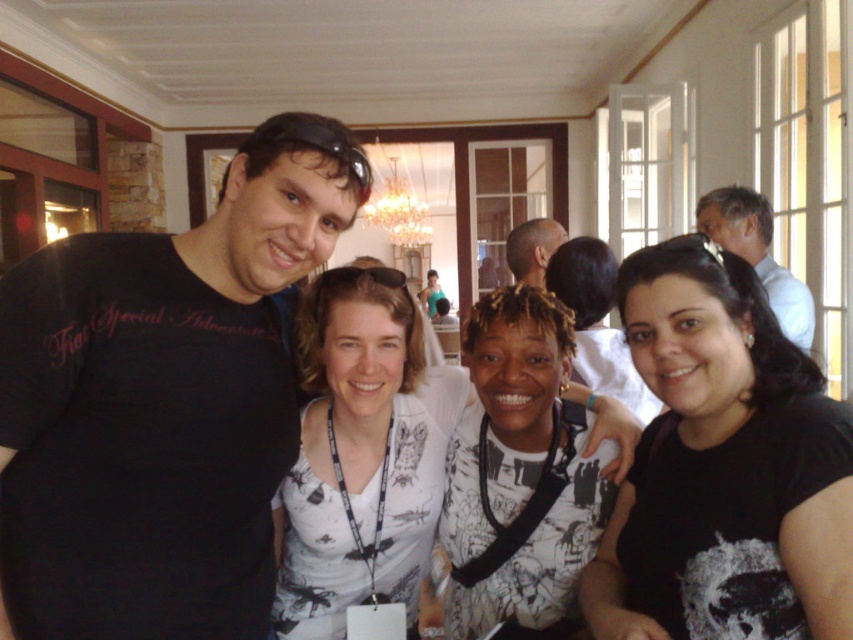
Can you confirm if black matte shirt at left is smaller than bald head at center?

No, black matte shirt at left is not smaller than bald head at center.

This screenshot has height=640, width=853. Describe the element at coordinates (161, 403) in the screenshot. I see `black matte shirt at left` at that location.

You are a GUI agent. You are given a task and a screenshot of the screen. Output one action in this format:
    pyautogui.click(x=<x>, y=<y>)
    Task: Click on the black matte shirt at left
    The image size is (853, 640).
    Given the screenshot: What is the action you would take?
    pyautogui.click(x=161, y=403)

Does black matte shirt at lower right have a smaller size compared to bald head at center?

No.

Between black matte shirt at lower right and bald head at center, which one is positioned lower?

Positioned lower is black matte shirt at lower right.

Is point (647, 616) positioned before point (515, 264)?

Yes, it is in front of point (515, 264).

I want to click on black matte shirt at lower right, so click(x=724, y=467).

Can you confirm if white shirt at upper right is positioned below bald head at center?

Yes.

Between white shirt at upper right and bald head at center, which one is positioned higher?

bald head at center is higher up.

Is point (790, 324) in front of point (544, 252)?

Yes, point (790, 324) is closer to viewer.

Find the location of `white shirt at upper right`. white shirt at upper right is located at coordinates (757, 253).